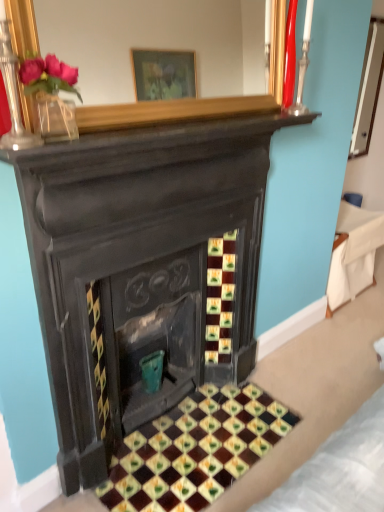
The width and height of the screenshot is (384, 512). What are the coordinates of `empty space that is ontop of glazed ceramic tiles at center (from a real-world perspective)` in the screenshot? It's located at (196, 440).